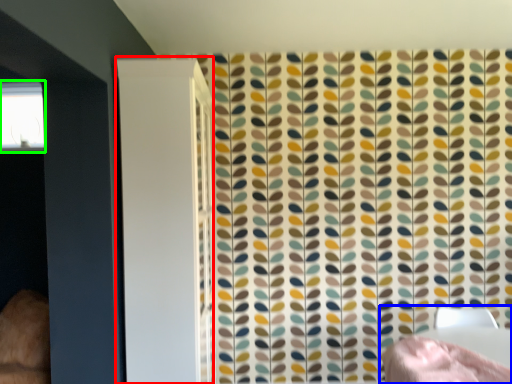
Question: Which object is the closest to the screen door (highlighted by a red box)? Choose among these: bed (highlighted by a blue box) or window (highlighted by a green box).

Choices:
 (A) bed
 (B) window

Answer: (A)